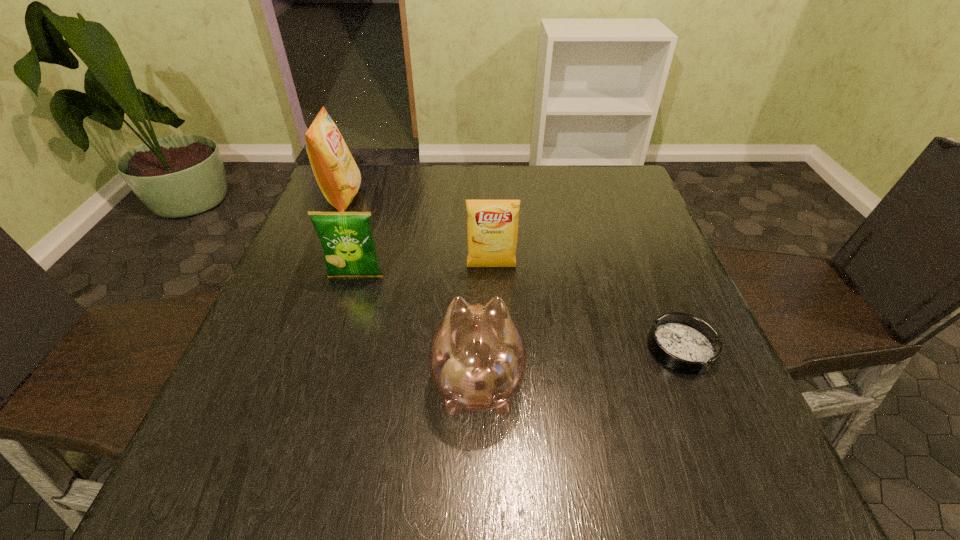
Where is `the tallest crisp (potato chip)`? Image resolution: width=960 pixels, height=540 pixels. the tallest crisp (potato chip) is located at coordinates (337, 174).

What are the coordinates of `the farthest crisp (potato chip)` in the screenshot? It's located at (337, 174).

This screenshot has width=960, height=540. What are the coordinates of `the rightmost crisp (potato chip)` in the screenshot? It's located at pyautogui.click(x=492, y=226).

You are a GUI agent. You are given a task and a screenshot of the screen. Output one action in this format:
    pyautogui.click(x=<x>, y=<y>)
    Task: Click on the piggy bank
    Image resolution: width=960 pixels, height=540 pixels.
    Given the screenshot: What is the action you would take?
    pyautogui.click(x=477, y=357)

You are a GUI agent. You are given a task and a screenshot of the screen. Output one action in this format:
    pyautogui.click(x=<x>, y=<y>)
    Task: Click on the shortest object
    The height and width of the screenshot is (540, 960).
    Given the screenshot: What is the action you would take?
    pyautogui.click(x=685, y=343)

Locate an element on the screen. the rightmost object is located at coordinates (685, 343).

In order to click on vacant space located 0.280m on the front-facing side of the tallest object in this screenshot , I will do `click(463, 198)`.

Image resolution: width=960 pixels, height=540 pixels. What are the coordinates of `free space located on the front of the rightmost crisp (potato chip) with the logo` in the screenshot? It's located at (495, 393).

Where is `free spot located on the front facing side of the piggy bank`? free spot located on the front facing side of the piggy bank is located at coordinates (478, 228).

You are a GUI agent. You are given a task and a screenshot of the screen. Output one action in this format:
    pyautogui.click(x=<x>, y=<y>)
    Task: Click on the vacant position located on the front facing side of the piggy bank
    
    Given the screenshot: What is the action you would take?
    pyautogui.click(x=478, y=248)